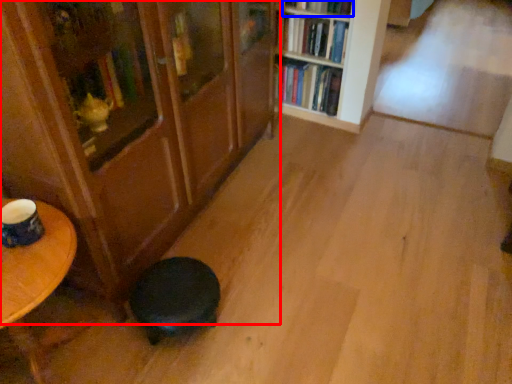
Question: Which of the following is the farthest to the observer, bookcase (highlighted by a red box) or book (highlighted by a blue box)?

Choices:
 (A) bookcase
 (B) book

Answer: (B)